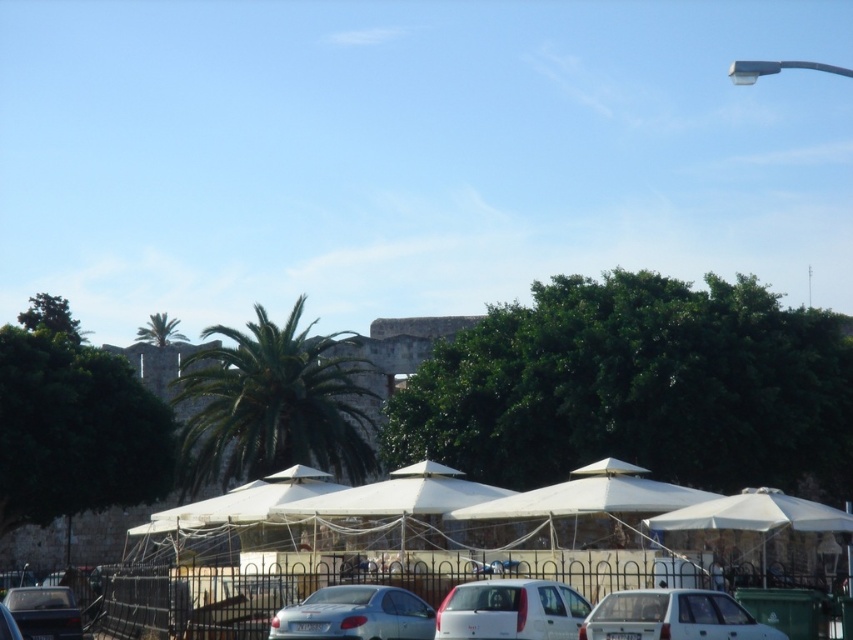
Does green leafy palm tree at center appear over matte gray car at lower left?

Correct, green leafy palm tree at center is located above matte gray car at lower left.

Which is behind, point (216, 368) or point (78, 634)?

The point (216, 368) is behind.

Where is `green leafy palm tree at center`? green leafy palm tree at center is located at coordinates (271, 404).

Who is lower down, green leafy palm tree at center or green leafy palm tree at upper left?

green leafy palm tree at center

Is green leafy palm tree at center above green leafy palm tree at upper left?

No, green leafy palm tree at center is not above green leafy palm tree at upper left.

Is point (326, 417) positioned before point (165, 317)?

Yes, point (326, 417) is in front of point (165, 317).

What are the coordinates of `green leafy palm tree at center` in the screenshot? It's located at (271, 404).

Between silver metallic car at lower right and matte gray car at lower left, which one is positioned higher?

silver metallic car at lower right

Does silver metallic car at lower right have a greater height compared to matte gray car at lower left?

Incorrect, silver metallic car at lower right's height is not larger of matte gray car at lower left's.

Between point (675, 625) and point (18, 618), which one is positioned behind?

Positioned behind is point (18, 618).

You are a GUI agent. You are given a task and a screenshot of the screen. Output one action in this format:
    pyautogui.click(x=<x>, y=<y>)
    Task: Click on the silver metallic car at lower right
    
    Given the screenshot: What is the action you would take?
    pyautogui.click(x=672, y=616)